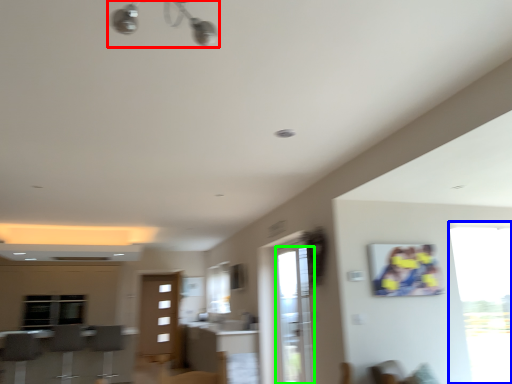
Question: Which object is the closest to the light fixture (highlighted by a red box)? Choose among these: window (highlighted by a blue box) or screen door (highlighted by a green box).

Choices:
 (A) window
 (B) screen door

Answer: (B)